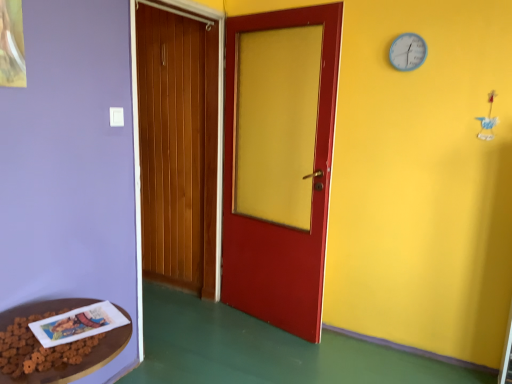
The height and width of the screenshot is (384, 512). In order to click on white paper book at lower left in this screenshot , I will do `click(78, 324)`.

The height and width of the screenshot is (384, 512). I want to click on white paper book at lower left, so click(x=78, y=324).

Is the position of white paper book at lower left more distant than that of brown wooden table at lower left?

Yes, the depth of white paper book at lower left is greater than that of brown wooden table at lower left.

Is white paper book at lower left aimed at brown wooden table at lower left?

Yes, white paper book at lower left is facing brown wooden table at lower left.

Does white paper book at lower left appear on the left side of brown wooden table at lower left?

No, white paper book at lower left is not to the left of brown wooden table at lower left.

Is blue plastic clock at upper right completely or partially outside of brown wooden table at lower left?

Yes, blue plastic clock at upper right is outside of brown wooden table at lower left.

Is blue plastic clock at upper right positioned before brown wooden table at lower left?

No, it is behind brown wooden table at lower left.

Considering the sizes of objects blue plastic clock at upper right and brown wooden table at lower left in the image provided, who is bigger, blue plastic clock at upper right or brown wooden table at lower left?

Bigger between the two is brown wooden table at lower left.

From a real-world perspective, which is physically below, blue plastic clock at upper right or brown wooden table at lower left?

brown wooden table at lower left, from a real-world perspective.

Would you say brown wooden table at lower left is a long distance from blue plastic clock at upper right?

Absolutely, brown wooden table at lower left is distant from blue plastic clock at upper right.

Is point (90, 356) positioned before point (413, 63)?

Yes, point (90, 356) is closer to viewer.

Is brown wooden table at lower left bigger than blue plastic clock at upper right?

Yes, brown wooden table at lower left is bigger than blue plastic clock at upper right.

Is point (409, 42) positioned after point (119, 321)?

Yes, point (409, 42) is farther from viewer.

Is blue plastic clock at upper right turned away from white paper book at lower left?

No.

Between blue plastic clock at upper right and white paper book at lower left, which one has larger size?

Bigger between the two is blue plastic clock at upper right.

From the image's perspective, is blue plastic clock at upper right beneath white paper book at lower left?

Incorrect, from the image's perspective, blue plastic clock at upper right is higher than white paper book at lower left.

Is brown wooden table at lower left turned away from white paper book at lower left?

Absolutely, brown wooden table at lower left is directed away from white paper book at lower left.

In the image, there is a white paper book at lower left. What are the coordinates of `table below it (from the image's perspective)` in the screenshot? It's located at (84, 359).

Does brown wooden table at lower left have a greater width compared to white paper book at lower left?

Yes.

Can you confirm if brown wooden table at lower left is bigger than white paper book at lower left?

Yes, brown wooden table at lower left is bigger than white paper book at lower left.

Could you tell me if white paper book at lower left is facing blue plastic clock at upper right?

No, white paper book at lower left is not oriented towards blue plastic clock at upper right.

Are white paper book at lower left and blue plastic clock at upper right far apart?

Yes, white paper book at lower left is far from blue plastic clock at upper right.

Does white paper book at lower left come behind blue plastic clock at upper right?

No, it is not.

Locate an element on the screen. The image size is (512, 384). book on the right of brown wooden table at lower left is located at coordinates (78, 324).

This screenshot has height=384, width=512. Find the location of `clock above the brown wooden table at lower left (from the image's perspective)`. clock above the brown wooden table at lower left (from the image's perspective) is located at coordinates (408, 52).

Considering their positions, is white paper book at lower left positioned further to blue plastic clock at upper right than brown wooden table at lower left?

Based on the image, brown wooden table at lower left appears to be further to blue plastic clock at upper right.

Which object lies nearer to the anchor point brown wooden table at lower left, white paper book at lower left or blue plastic clock at upper right?

white paper book at lower left lies closer to brown wooden table at lower left than the other object.

Looking at the image, which one is located further to white paper book at lower left, brown wooden table at lower left or blue plastic clock at upper right?

blue plastic clock at upper right is positioned further to the anchor white paper book at lower left.

When comparing their distances from blue plastic clock at upper right, does brown wooden table at lower left or white paper book at lower left seem closer?

Based on the image, white paper book at lower left appears to be nearer to blue plastic clock at upper right.

From the image, which object appears to be farther from brown wooden table at lower left, blue plastic clock at upper right or white paper book at lower left?

The object further to brown wooden table at lower left is blue plastic clock at upper right.

From the image, which object appears to be nearer to white paper book at lower left, blue plastic clock at upper right or brown wooden table at lower left?

The object closer to white paper book at lower left is brown wooden table at lower left.

Image resolution: width=512 pixels, height=384 pixels. I want to click on book between brown wooden table at lower left and blue plastic clock at upper right from left to right, so click(78, 324).